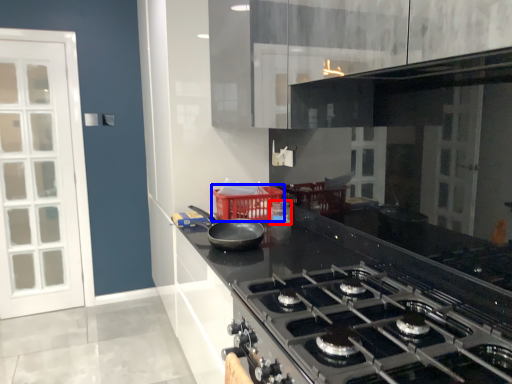
Question: Which point is closer to the camera, appliance (highlighted by a red box) or basket (highlighted by a blue box)?

Choices:
 (A) appliance
 (B) basket

Answer: (B)